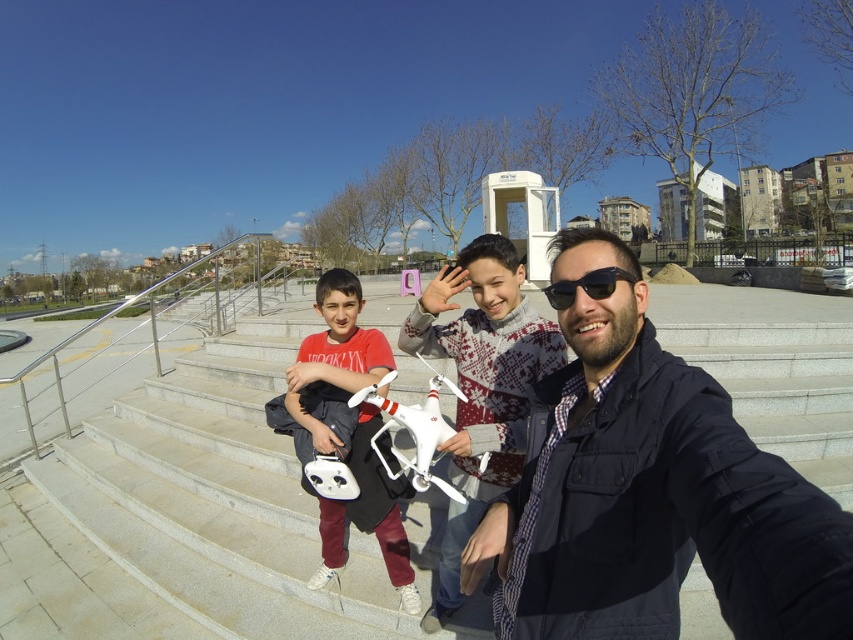
You are a drone operator who needs to choose between the white matte drone at center and the matte white drone at center for a photography mission. Which one should you select if you want the bigger drone for better camera quality?

The white matte drone at center is larger than the matte white drone at center, so you should select the white matte drone at center for better camera quality due to its larger size.

You are a photographer trying to capture both the dark blue jacket at center and the white matte drone at center in a single shot. Which object should you adjust your camera angle to focus on first to ensure both fit in the frame?

Since the dark blue jacket at center is narrower than the white matte drone at center, you should focus on the wider white matte drone at center first to ensure both fit in the frame.

You are standing on the stone steps and want to walk from point A to point B. Point A is at coordinates point (247, 348) and point B is at coordinates point (520, 323). Which point is closer to you?

Point A at coordinates point (247, 348) is closer to you than point B at coordinates point (520, 323) because it is further to the viewer.